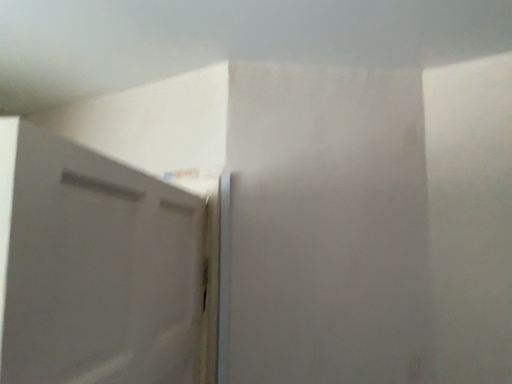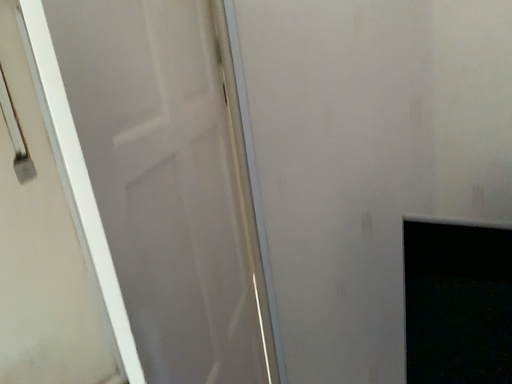
Question: How did the camera likely rotate when shooting the video?

Choices:
 (A) rotated upward
 (B) rotated downward

Answer: (B)